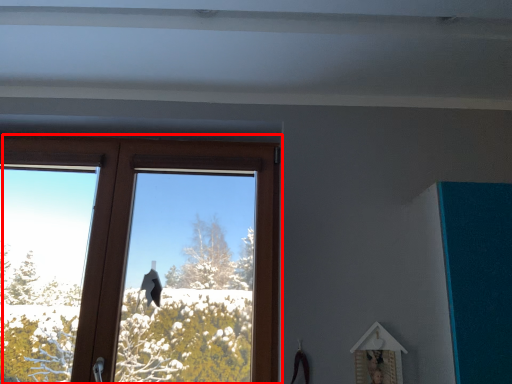
Question: From the image's perspective, where is window (annotated by the red box) located in relation to picture frame in the image?

Choices:
 (A) below
 (B) above

Answer: (B)